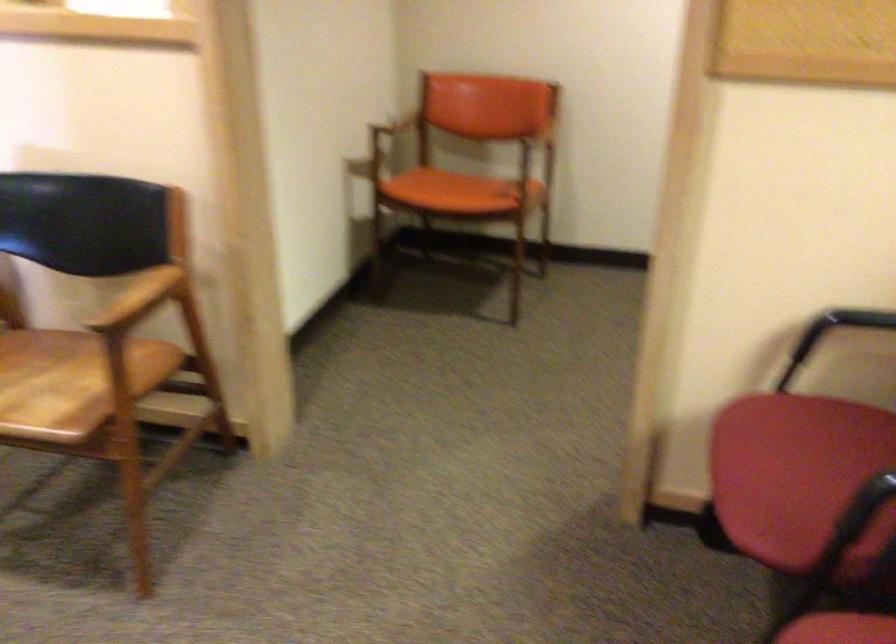
Locate an element on the screen. wooden chair sitting surface is located at coordinates (71, 381).